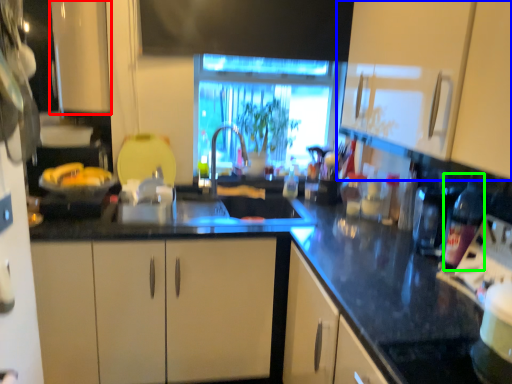
Question: Which object is the farthest from cabinetry (highlighted by a red box)? Choose among these: cabinetry (highlighted by a blue box) or bottle (highlighted by a green box).

Choices:
 (A) cabinetry
 (B) bottle

Answer: (B)